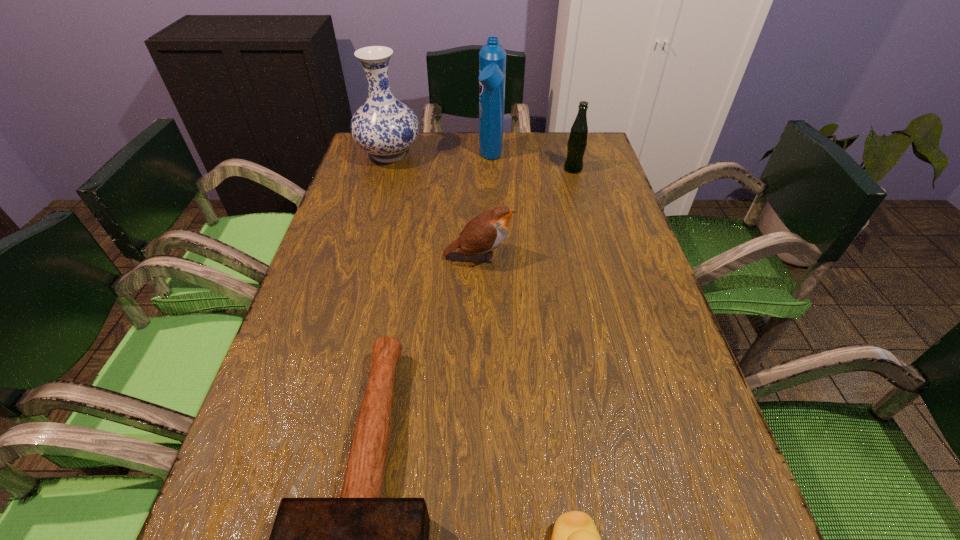
At what (x,y) coordinates should I click in order to perform the action: click on shampoo. Please return your answer as a coordinate pair (x, y). Looking at the image, I should click on (492, 57).

This screenshot has width=960, height=540. Find the location of `vase`. vase is located at coordinates (383, 126).

Identify the location of beer bottle. (577, 142).

The height and width of the screenshot is (540, 960). Identify the location of the rightmost object. (577, 142).

What are the coordinates of `the third nearest object` in the screenshot? It's located at (487, 231).

Where is `bird`? Image resolution: width=960 pixels, height=540 pixels. bird is located at coordinates (487, 231).

I want to click on vacant area situated 0.100m on the left of the shampoo, so click(x=446, y=159).

Locate an element on the screen. The image size is (960, 540). vacant space positioned 0.100m on the right of the vase is located at coordinates (454, 155).

The width and height of the screenshot is (960, 540). I want to click on vacant space situated 0.280m on the front of the rightmost object, so click(x=591, y=235).

The image size is (960, 540). I want to click on blank space located 0.200m at the face of the bird, so click(x=599, y=257).